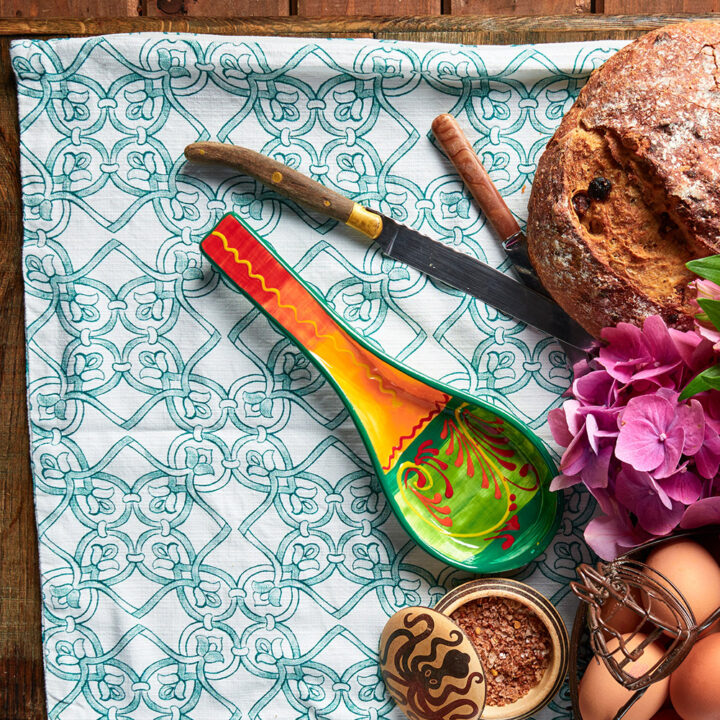
Where is `spices container`? The width and height of the screenshot is (720, 720). spices container is located at coordinates (504, 662).